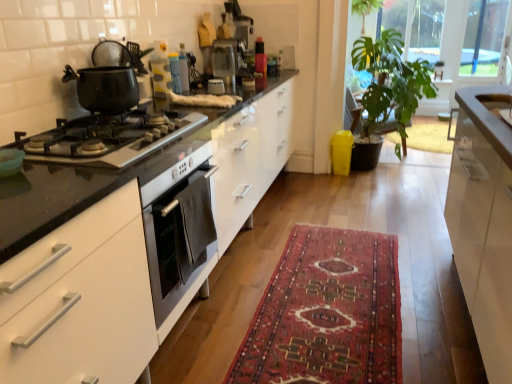
At what (x,y) coordinates should I click in order to perform the action: click on free spot above red woven rug at center (from a real-world perspective). Please return your answer as a coordinate pair (x, y). This screenshot has width=512, height=384. Looking at the image, I should click on [x=327, y=290].